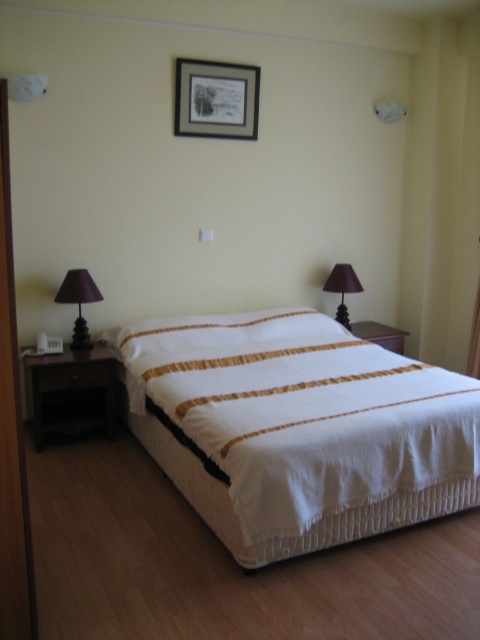
Does point (84, 285) come closer to viewer compared to point (346, 269)?

That is True.

Does matte purple fabric lampshade at left have a greater width compared to matte brown lampshade at upper right?

Yes.

Is point (74, 342) farther from camera compared to point (348, 326)?

That is False.

Identify the location of matte purple fabric lampshade at left. 79,301.

Can you confirm if black wood picture frame at upper center is smaller than matte brown lampshade at upper right?

No, black wood picture frame at upper center is not smaller than matte brown lampshade at upper right.

Who is shorter, black wood picture frame at upper center or matte brown lampshade at upper right?

Standing shorter between the two is matte brown lampshade at upper right.

This screenshot has width=480, height=640. What do you see at coordinates (216, 99) in the screenshot?
I see `black wood picture frame at upper center` at bounding box center [216, 99].

Find the location of a particular element. Image resolution: width=480 pixels, height=640 pixels. black wood picture frame at upper center is located at coordinates (216, 99).

Can you confirm if white textured bed at center is bigger than matte brown lampshade at upper right?

Indeed, white textured bed at center has a larger size compared to matte brown lampshade at upper right.

What do you see at coordinates (300, 428) in the screenshot?
I see `white textured bed at center` at bounding box center [300, 428].

At what (x,y) coordinates should I click in order to perform the action: click on white textured bed at center. Please return your answer as a coordinate pair (x, y). Image resolution: width=480 pixels, height=640 pixels. Looking at the image, I should click on (300, 428).